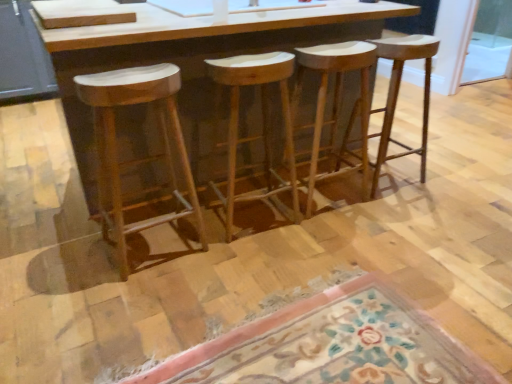
I want to click on natural wood stool at center, the fourth stool viewed from the left, so click(398, 93).

You are a GUI agent. You are given a task and a screenshot of the screen. Output one action in this format:
    pyautogui.click(x=<x>, y=<y>)
    Task: Click on the transparent glass screen door at upper right
    Image resolution: width=512 pixels, height=384 pixels.
    Given the screenshot: What is the action you would take?
    pyautogui.click(x=489, y=42)

This screenshot has width=512, height=384. What do you see at coordinates (257, 135) in the screenshot?
I see `natural wood stool at center, which appears as the second stool when viewed from the left` at bounding box center [257, 135].

Find the location of `natural wood stool at center, the 2th stool in the right-to-left sequence`. natural wood stool at center, the 2th stool in the right-to-left sequence is located at coordinates (334, 107).

From the picture: Which is behind, natural wood stool at left, arranged as the first stool when viewed from the left, or floral carpet at lower center?

natural wood stool at left, arranged as the first stool when viewed from the left.

Is natural wood stool at left, arranged as the first stool when viewed from the left, inside the boundaries of floral carpet at lower center, or outside?

natural wood stool at left, arranged as the first stool when viewed from the left, lies outside floral carpet at lower center.

From a real-world perspective, is natural wood stool at left, arranged as the first stool when viewed from the left, located beneath floral carpet at lower center?

No, from a real-world perspective, natural wood stool at left, arranged as the first stool when viewed from the left, is not under floral carpet at lower center.

Is point (160, 215) positioned in front of point (425, 365)?

No.

Consider the image. Between natural wood stool at center, which ranks as the third stool in left-to-right order, and transparent glass screen door at upper right, which one has larger size?

Bigger between the two is natural wood stool at center, which ranks as the third stool in left-to-right order.

Based on the photo, is natural wood stool at center, which ranks as the third stool in left-to-right order, not close to transparent glass screen door at upper right?

Yes, natural wood stool at center, which ranks as the third stool in left-to-right order, is far from transparent glass screen door at upper right.

Does point (338, 103) lie in front of point (472, 55)?

That is True.

Can you tell me how much natural wood stool at center, which appears as the second stool when viewed from the left, and natural wood stool at center, the fourth stool viewed from the left, differ in facing direction?

5.26 degrees separate the facing orientations of natural wood stool at center, which appears as the second stool when viewed from the left, and natural wood stool at center, the fourth stool viewed from the left.

Consider the image. From a real-world perspective, is natural wood stool at center, the 3th stool when ordered from right to left, positioned over natural wood stool at center, the fourth stool viewed from the left, based on gravity?

No, from a real-world perspective, natural wood stool at center, the 3th stool when ordered from right to left, is not over natural wood stool at center, the fourth stool viewed from the left

Which is behind, natural wood stool at center, which appears as the second stool when viewed from the left, or natural wood stool at center, the fourth stool viewed from the left?

natural wood stool at center, the fourth stool viewed from the left, is further away from the camera.

The image size is (512, 384). Identify the location of stool that is the 2nd object located in front of the natural wood stool at center, the 1th stool from the right. (257, 135).

Consider the image. Would you say wooden barstools at center is inside or outside natural wood stool at center, the 1th stool from the right?

The correct answer is: outside.

From a real-world perspective, who is located higher, wooden barstools at center or natural wood stool at center, the fourth stool viewed from the left?

In real-world perspective, wooden barstools at center is above.

Considering the sizes of objects wooden barstools at center and natural wood stool at center, the fourth stool viewed from the left, in the image provided, who is smaller, wooden barstools at center or natural wood stool at center, the fourth stool viewed from the left,?

Smaller between the two is natural wood stool at center, the fourth stool viewed from the left.

From the image's perspective, is wooden barstools at center over natural wood stool at center, the 1th stool from the right?

Yes, from the image's perspective, wooden barstools at center is above natural wood stool at center, the 1th stool from the right.

Is wooden barstools at center aimed at natural wood stool at left, which is counted as the fourth stool, starting from the right?

Yes.

Considering the relative sizes of wooden barstools at center and natural wood stool at left, arranged as the first stool when viewed from the left, in the image provided, is wooden barstools at center thinner than natural wood stool at left, arranged as the first stool when viewed from the left,?

Incorrect, the width of wooden barstools at center is not less than that of natural wood stool at left, arranged as the first stool when viewed from the left.

Which of these two, wooden barstools at center or natural wood stool at left, arranged as the first stool when viewed from the left, stands taller?

With more height is wooden barstools at center.

Between wooden barstools at center and natural wood stool at left, which is counted as the fourth stool, starting from the right, which one has larger size?

With larger size is wooden barstools at center.

Can you confirm if floral carpet at lower center is bigger than wooden barstools at center?

No, floral carpet at lower center is not bigger than wooden barstools at center.

Is point (460, 347) closer to camera compared to point (192, 48)?

Yes, it is in front of point (192, 48).

Which of these two, floral carpet at lower center or wooden barstools at center, stands shorter?

Standing shorter between the two is floral carpet at lower center.

You are a GUI agent. You are given a task and a screenshot of the screen. Output one action in this format:
    pyautogui.click(x=<x>, y=<y>)
    Task: Click on the counter that appears above the natural wood stool at center, the 3th stool when ordered from right to left (from the image's perspective)
    The height and width of the screenshot is (384, 512).
    Given the screenshot: What is the action you would take?
    pyautogui.click(x=192, y=55)

Can you confirm if wooden barstools at center is smaller than natural wood stool at center, the 3th stool when ordered from right to left?

Incorrect, wooden barstools at center is not smaller in size than natural wood stool at center, the 3th stool when ordered from right to left.

Does wooden barstools at center appear on the right side of natural wood stool at center, which appears as the second stool when viewed from the left?

No.

Between wooden barstools at center and natural wood stool at center, which appears as the second stool when viewed from the left, which one has larger width?

wooden barstools at center.

You are a GUI agent. You are given a task and a screenshot of the screen. Output one action in this format:
    pyautogui.click(x=<x>, y=<y>)
    Task: Click on the doormat beneath the natural wood stool at left, arranged as the first stool when viewed from the left (from a real-world perspective)
    
    Given the screenshot: What is the action you would take?
    pyautogui.click(x=331, y=345)

From the image's perspective, count 2nd stools downward from the transparent glass screen door at upper right and point to it. Please provide its 2D coordinates.

[(334, 107)]

Considering their positions, is wooden barstools at center positioned further to natural wood stool at left, which is counted as the fourth stool, starting from the right, than natural wood stool at center, the 3th stool when ordered from right to left?

Based on the image, natural wood stool at center, the 3th stool when ordered from right to left, appears to be further to natural wood stool at left, which is counted as the fourth stool, starting from the right.

Looking at the image, which one is located closer to natural wood stool at center, the 1th stool from the right, floral carpet at lower center or natural wood stool at center, which ranks as the third stool in left-to-right order?

Among the two, natural wood stool at center, which ranks as the third stool in left-to-right order, is located nearer to natural wood stool at center, the 1th stool from the right.

Which object lies nearer to the anchor point transparent glass screen door at upper right, natural wood stool at center, the 1th stool from the right, or wooden barstools at center?

natural wood stool at center, the 1th stool from the right, lies closer to transparent glass screen door at upper right than the other object.

Estimate the real-world distances between objects in this image. Which object is closer to natural wood stool at left, arranged as the first stool when viewed from the left, natural wood stool at center, the 3th stool when ordered from right to left, or wooden barstools at center?

wooden barstools at center.

Based on the photo, which object lies further to the anchor point transparent glass screen door at upper right, natural wood stool at left, arranged as the first stool when viewed from the left, or floral carpet at lower center?

floral carpet at lower center.

When comparing their distances from natural wood stool at center, which appears as the second stool when viewed from the left, does natural wood stool at left, arranged as the first stool when viewed from the left, or floral carpet at lower center seem further?

Based on the image, floral carpet at lower center appears to be further to natural wood stool at center, which appears as the second stool when viewed from the left.

Estimate the real-world distances between objects in this image. Which object is further from natural wood stool at center, the 2th stool in the right-to-left sequence, wooden barstools at center or floral carpet at lower center?

floral carpet at lower center.

Which object lies further to the anchor point natural wood stool at center, which ranks as the third stool in left-to-right order, transparent glass screen door at upper right or floral carpet at lower center?

transparent glass screen door at upper right is further to natural wood stool at center, which ranks as the third stool in left-to-right order.

Where is `stool between natural wood stool at center, the 2th stool in the right-to-left sequence, and transparent glass screen door at upper right, along the z-axis`? The width and height of the screenshot is (512, 384). stool between natural wood stool at center, the 2th stool in the right-to-left sequence, and transparent glass screen door at upper right, along the z-axis is located at coordinates (398, 93).

I want to click on doormat between natural wood stool at left, arranged as the first stool when viewed from the left, and natural wood stool at center, the 1th stool from the right, from left to right, so click(x=331, y=345).

Where is `counter located between natural wood stool at left, arranged as the first stool when viewed from the left, and natural wood stool at center, which ranks as the third stool in left-to-right order, in the left-right direction`? The image size is (512, 384). counter located between natural wood stool at left, arranged as the first stool when viewed from the left, and natural wood stool at center, which ranks as the third stool in left-to-right order, in the left-right direction is located at coordinates (192, 55).

Identify the location of stool between wooden barstools at center and natural wood stool at center, which ranks as the third stool in left-to-right order, in the horizontal direction. (257, 135).